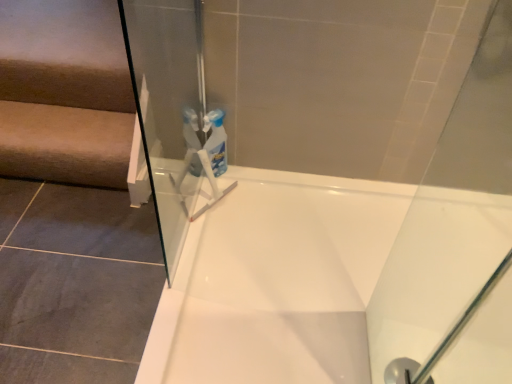
At what (x,y) coordinates should I click in order to perform the action: click on free region under white glossy bathtub at center (from a real-world perspective). Please return your answer as a coordinate pair (x, y). Looking at the image, I should click on (368, 324).